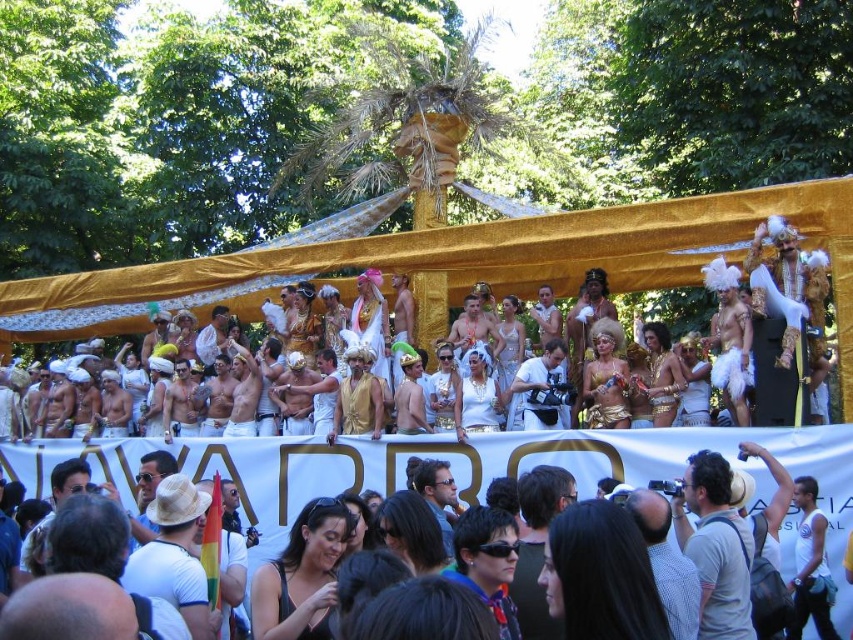
Is plaid shirt at center to the left of golden fabric turban at center from the viewer's perspective?

Incorrect, plaid shirt at center is not on the left side of golden fabric turban at center.

Is plaid shirt at center positioned in front of golden fabric turban at center?

Yes, plaid shirt at center is closer to the viewer.

Measure the distance between point [677,620] and camera.

A distance of 40.74 meters exists between point [677,620] and camera.

Where is `plaid shirt at center`? This screenshot has height=640, width=853. plaid shirt at center is located at coordinates (666, 563).

Who is shorter, matte white shirt at center or gold metallic costume at center?

gold metallic costume at center is shorter.

At what (x,y) coordinates should I click in order to perform the action: click on matte white shirt at center. Please return your answer as a coordinate pair (x, y). Image resolution: width=853 pixels, height=640 pixels. Looking at the image, I should click on (537, 547).

Identify the location of white matte tank top at lower right. Image resolution: width=853 pixels, height=640 pixels. 810,564.

Is point (824, 540) positioned before point (242, 433)?

Yes, it is.

Identify the location of white matte tank top at lower right. (810, 564).